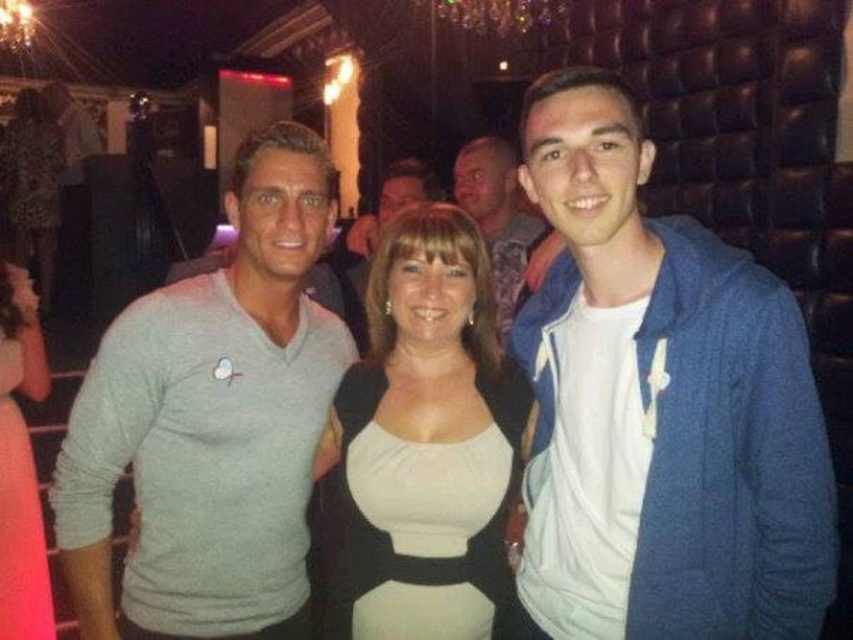
I want to click on gray matte sweater at left, so click(212, 420).

Who is positioned more to the left, gray matte sweater at left or blue cotton hoodie at center?

From the viewer's perspective, gray matte sweater at left appears more on the left side.

Where is `gray matte sweater at left`? gray matte sweater at left is located at coordinates (212, 420).

Does white matte dress at center appear under matte black dress at center?

Correct, white matte dress at center is located below matte black dress at center.

How distant is white matte dress at center from matte black dress at center?

They are 5.58 meters apart.

Is point (444, 451) behind point (50, 260)?

That is False.

In order to click on white matte dress at center in this screenshot , I will do `click(422, 444)`.

Between gray matte sweater at left and matte black dress at center, which one appears on the right side from the viewer's perspective?

gray matte sweater at left is more to the right.

Does gray matte sweater at left have a lesser height compared to matte black dress at center?

Yes, gray matte sweater at left is shorter than matte black dress at center.

Which is in front, point (259, 525) or point (47, 211)?

Point (259, 525) is in front.

At what (x,y) coordinates should I click in order to perform the action: click on gray matte sweater at left. Please return your answer as a coordinate pair (x, y). Image resolution: width=853 pixels, height=640 pixels. Looking at the image, I should click on (212, 420).